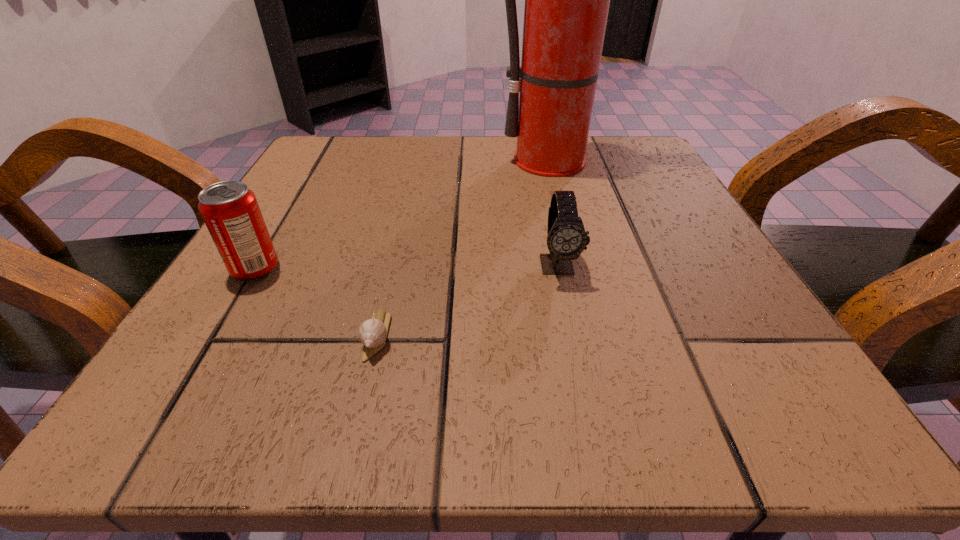
The image size is (960, 540). Find the location of `vacant region between the shortest object and the soda can`. vacant region between the shortest object and the soda can is located at coordinates (316, 302).

Find the location of a particular element. This screenshot has width=960, height=540. blank region between the watch and the escargot is located at coordinates (468, 300).

Locate an element on the screen. free space between the second object from left to right and the soda can is located at coordinates (316, 302).

Where is `free spot between the nearest object and the watch`? The height and width of the screenshot is (540, 960). free spot between the nearest object and the watch is located at coordinates (468, 300).

Image resolution: width=960 pixels, height=540 pixels. I want to click on vacant area between the watch and the escargot, so click(468, 300).

Where is `vacant space that's between the third object from right to left and the tallest object`? vacant space that's between the third object from right to left and the tallest object is located at coordinates (468, 248).

Where is `free space between the soda can and the watch`? free space between the soda can and the watch is located at coordinates (407, 267).

You are a GUI agent. You are given a task and a screenshot of the screen. Output one action in this format:
    pyautogui.click(x=<x>, y=<y>)
    Task: Click on the vacant space that is in between the watch and the leftmost object
    The height and width of the screenshot is (540, 960).
    Given the screenshot: What is the action you would take?
    407,267

Point out which object is positioned as the nearest to the watch. Please provide its 2D coordinates. Your answer should be formatted as a tuple, i.e. [(x, y)], where the tuple contains the x and y coordinates of a point satisfying the conditions above.

[(372, 333)]

Identify which object is the second closest to the leftmost object. Please provide its 2D coordinates. Your answer should be formatted as a tuple, i.e. [(x, y)], where the tuple contains the x and y coordinates of a point satisfying the conditions above.

[(566, 238)]